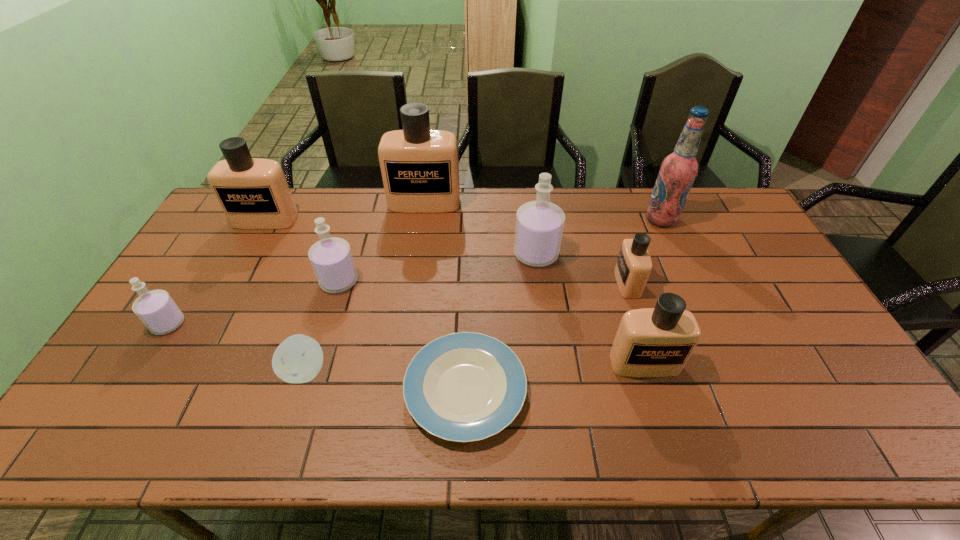
The height and width of the screenshot is (540, 960). I want to click on the rightmost object, so click(x=678, y=170).

You are a GUI agent. You are given a task and a screenshot of the screen. Output one action in this format:
    pyautogui.click(x=<x>, y=<y>)
    Task: Click on the alcohol
    This screenshot has height=540, width=960.
    Given the screenshot: What is the action you would take?
    pyautogui.click(x=678, y=170)

This screenshot has width=960, height=540. In order to click on the tallest perfume in this screenshot , I will do `click(420, 169)`.

Where is `the fourth perfume from left to right`? the fourth perfume from left to right is located at coordinates (420, 169).

I want to click on the leftmost beige perfume, so click(x=253, y=192).

Where is `the biggest purple perfume`? The width and height of the screenshot is (960, 540). the biggest purple perfume is located at coordinates (539, 224).

The height and width of the screenshot is (540, 960). Identify the location of the fifth perfume from left to right. (539, 224).

At what (x,y) coordinates should I click in order to perform the action: click on the fifth perfume from right to left. Please return your answer as a coordinate pair (x, y). This screenshot has width=960, height=540. Looking at the image, I should click on (331, 258).

Find the location of a particular element. Image resolution: width=960 pixels, height=540 pixels. the second biggest purple perfume is located at coordinates coord(331,258).

Locate an element on the screen. This screenshot has width=960, height=540. the nearest beige perfume is located at coordinates (651, 342).